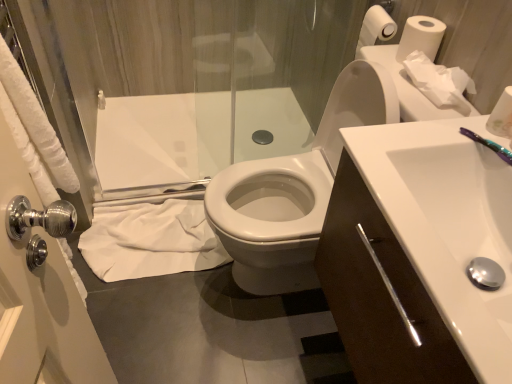
Locate an element on the screen. free point behind white cloth at lower left is located at coordinates (163, 166).